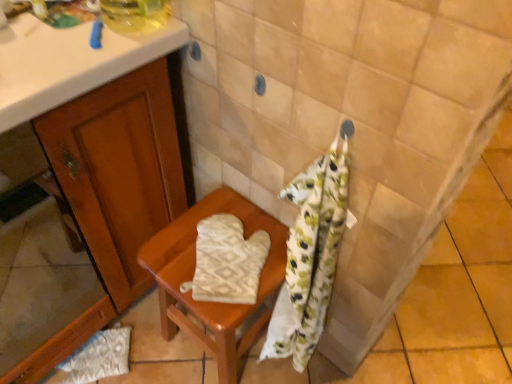
Question: From a real-world perspective, is beige fabric oven mitt at center positioned above or below beige textured oven mitt at center?

Choices:
 (A) above
 (B) below

Answer: (B)

Question: Considering the positions of point (158, 244) and point (219, 251), is point (158, 244) closer or farther from the camera than point (219, 251)?

Choices:
 (A) farther
 (B) closer

Answer: (A)

Question: Which of these objects is positioned farthest from the beige textured oven mitt at center?

Choices:
 (A) white textured oven mitt at lower left
 (B) beige fabric oven mitt at center

Answer: (A)

Question: Which of these objects is positioned farthest from the white textured oven mitt at lower left?

Choices:
 (A) beige textured oven mitt at center
 (B) beige fabric oven mitt at center

Answer: (A)